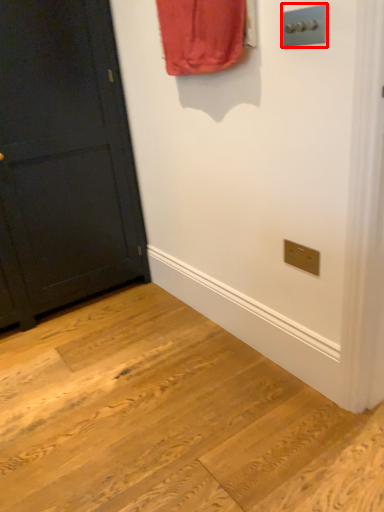
Question: In this image, where is light switch (annotated by the red box) located relative to door?

Choices:
 (A) left
 (B) right

Answer: (B)